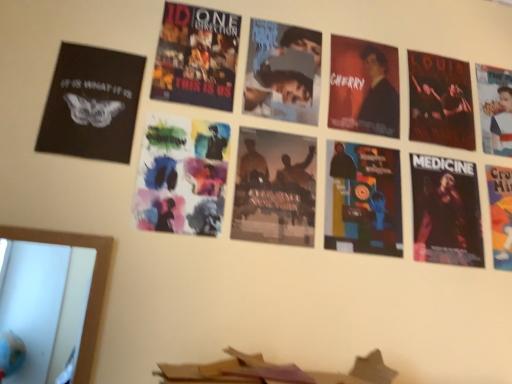
Question: Is watercolor paper at center, the sixth poster in the right-to-left sequence, shorter than orange paper poster at right, marked as the second poster in a right-to-left arrangement?

Choices:
 (A) no
 (B) yes

Answer: (B)

Question: Can you confirm if watercolor paper at center, which is the 2th poster in left-to-right order, is wider than orange paper poster at right, marked as the second poster in a right-to-left arrangement?

Choices:
 (A) no
 (B) yes

Answer: (B)

Question: Is watercolor paper at center, the sixth poster in the right-to-left sequence, outside orange paper poster at right, marked as the second poster in a right-to-left arrangement?

Choices:
 (A) no
 (B) yes

Answer: (B)

Question: Does watercolor paper at center, which is the 2th poster in left-to-right order, have a lesser width compared to orange paper poster at right, which is counted as the sixth poster, starting from the left?

Choices:
 (A) yes
 (B) no

Answer: (B)

Question: From the image's perspective, is watercolor paper at center, which is the 2th poster in left-to-right order, beneath orange paper poster at right, marked as the second poster in a right-to-left arrangement?

Choices:
 (A) yes
 (B) no

Answer: (B)

Question: From the image's perspective, is watercolor paper at center, the sixth poster in the right-to-left sequence, on top of orange paper poster at right, marked as the second poster in a right-to-left arrangement?

Choices:
 (A) yes
 (B) no

Answer: (A)

Question: Is black matte poster at upper left, which is the first poster from left to right, looking in the opposite direction of matte black suit at upper right?

Choices:
 (A) yes
 (B) no

Answer: (B)

Question: Can you confirm if black matte poster at upper left, arranged as the 7th poster when viewed from the right, is positioned to the left of matte black suit at upper right?

Choices:
 (A) yes
 (B) no

Answer: (A)

Question: Is black matte poster at upper left, arranged as the 7th poster when viewed from the right, wider than matte black suit at upper right?

Choices:
 (A) no
 (B) yes

Answer: (A)

Question: Does black matte poster at upper left, arranged as the 7th poster when viewed from the right, come behind matte black suit at upper right?

Choices:
 (A) no
 (B) yes

Answer: (A)

Question: From a real-world perspective, is black matte poster at upper left, which is the first poster from left to right, located beneath matte black suit at upper right?

Choices:
 (A) yes
 (B) no

Answer: (A)

Question: From the image's perspective, is black matte poster at upper left, which is the first poster from left to right, on matte black suit at upper right?

Choices:
 (A) yes
 (B) no

Answer: (B)

Question: From a real-world perspective, is matte black poster at center, the 4th poster when ordered from right to left, physically below black matte poster at upper left, which is the first poster from left to right?

Choices:
 (A) yes
 (B) no

Answer: (A)